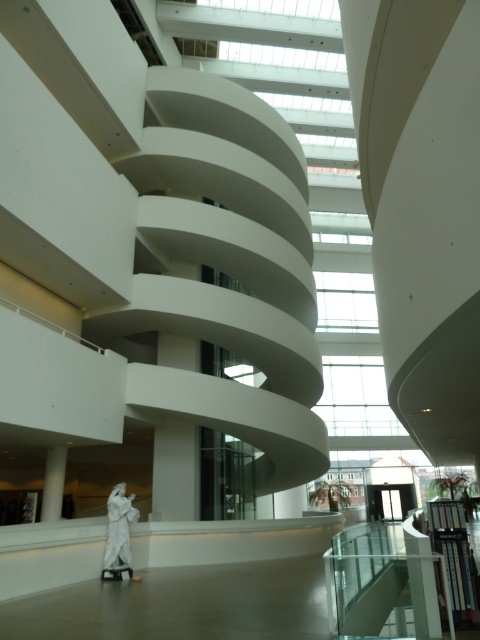
Looking at this image, between white glossy stair at lower center and white marble statue at center, which one is positioned lower?

white marble statue at center is lower down.

Does white glossy stair at lower center have a greater width compared to white marble statue at center?

Indeed, white glossy stair at lower center has a greater width compared to white marble statue at center.

Image resolution: width=480 pixels, height=640 pixels. In order to click on white glossy stair at lower center in this screenshot , I will do `click(374, 602)`.